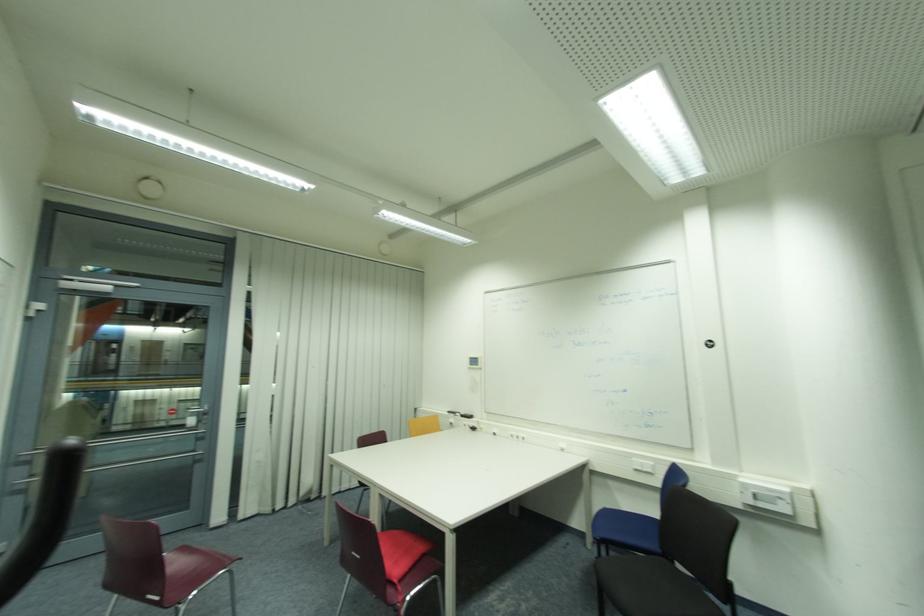
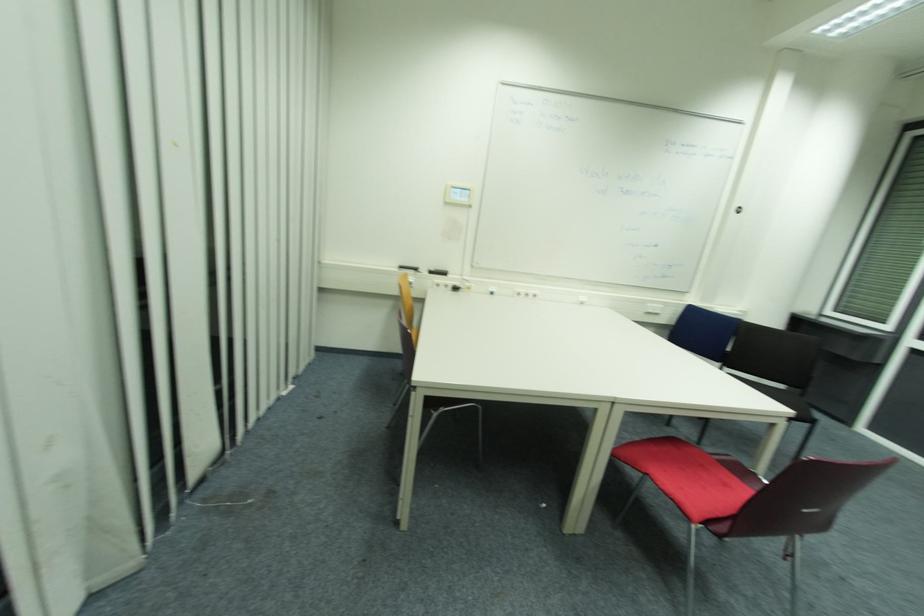
Find the pixel in the second image that matches point 458,415 in the first image.

(419, 270)